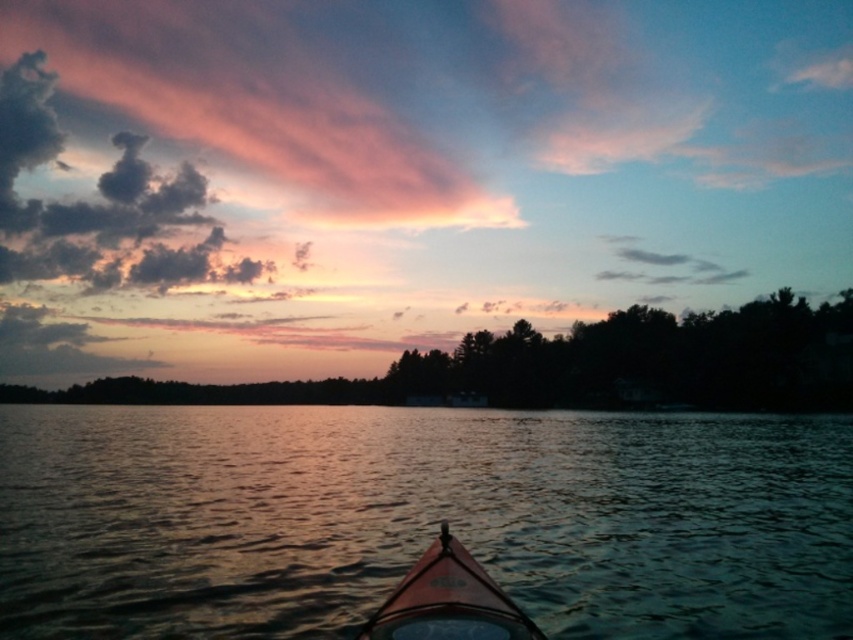
You are standing at the point marked by the coordinates point (x=421, y=518). Looking around, you see the shiny dark water at center. Which direction should you walk to reach the treeline silhouette?

Since the treeline silhouette is located at the upper part of the image and the shiny dark water at center is at point (x=421, y=518), you should walk upward to reach the treeline silhouette.

You are standing at the point closest to the water in the image. Which of the two points, point (x=692, y=508) or point (x=383, y=637), is farther away from you?

Point (x=692, y=508) is behind point (x=383, y=637), so it is farther away from you.